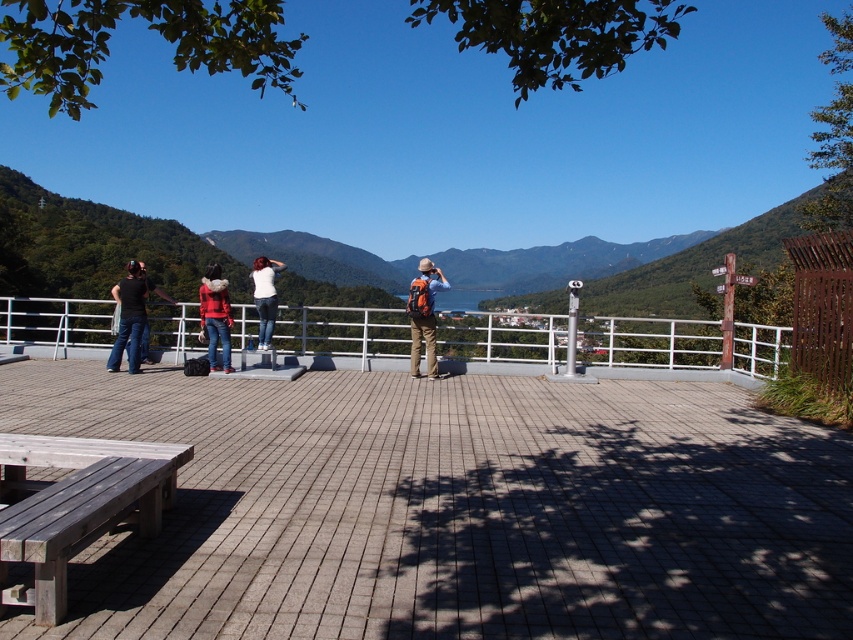
Does brown wooden deck at center have a greater height compared to matte black shirt at left?

Incorrect, brown wooden deck at center's height is not larger of matte black shirt at left's.

The image size is (853, 640). Describe the element at coordinates (456, 508) in the screenshot. I see `brown wooden deck at center` at that location.

Is point (309, 451) in front of point (120, 285)?

Yes, point (309, 451) is closer to viewer.

Where is `brown wooden deck at center`? This screenshot has height=640, width=853. brown wooden deck at center is located at coordinates (456, 508).

Looking at this image, does white metal rail at center have a lesser width compared to wooden picnic table at lower left?

In fact, white metal rail at center might be wider than wooden picnic table at lower left.

Between white metal rail at center and wooden picnic table at lower left, which one is positioned higher?

white metal rail at center

This screenshot has width=853, height=640. Describe the element at coordinates (648, 342) in the screenshot. I see `white metal rail at center` at that location.

At what (x,y) coordinates should I click in order to perform the action: click on white metal rail at center. Please return your answer as a coordinate pair (x, y). The image size is (853, 640). Looking at the image, I should click on 648,342.

Can you confirm if brown wooden deck at center is positioned below matte red jacket at center?

Correct, brown wooden deck at center is located below matte red jacket at center.

Which of these two, brown wooden deck at center or matte red jacket at center, stands taller?

Standing taller between the two is matte red jacket at center.

Find the location of a particular element. brown wooden deck at center is located at coordinates point(456,508).

Where is `brown wooden deck at center`? This screenshot has height=640, width=853. brown wooden deck at center is located at coordinates (456, 508).